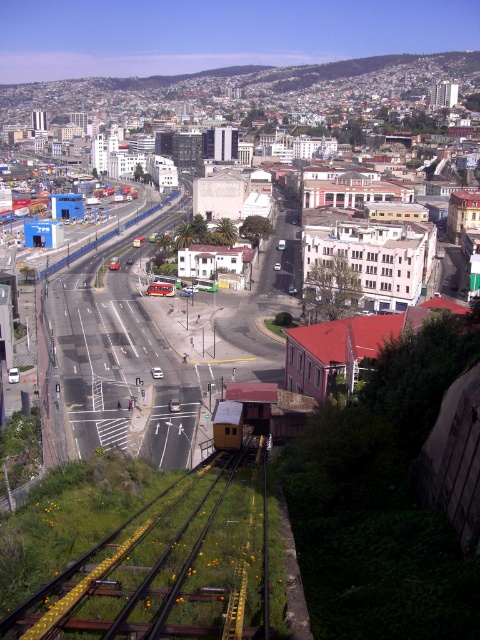
Is yellow metal train track at lower center thinner than yellow metallic train at center?

No.

Does yellow metal train track at lower center appear on the right side of yellow metallic train at center?

Yes, yellow metal train track at lower center is to the right of yellow metallic train at center.

Between point (177, 483) and point (153, 292), which one is positioned behind?

Positioned behind is point (153, 292).

Identify the location of yellow metal train track at lower center. coord(156,564).